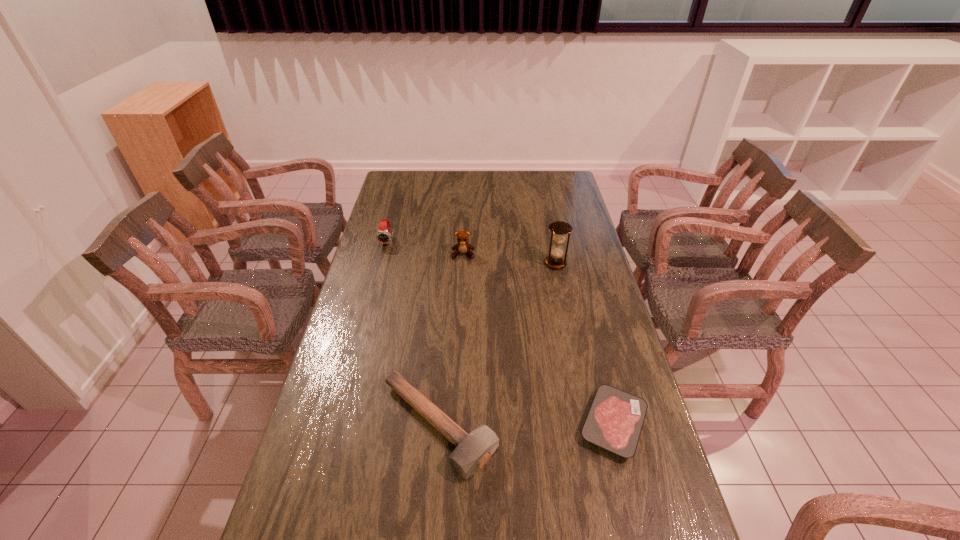
You are a GUI agent. You are given a task and a screenshot of the screen. Output one action in this format:
    pyautogui.click(x=<x>, y=<y>)
    Task: Click on the vacant space that satisfies the following two spatial constraints: 1. on the face of the steak; 2. on the left side of the farthest object
    This screenshot has height=540, width=960.
    Given the screenshot: What is the action you would take?
    coord(339,424)

At what (x,y) coordinates should I click in order to perform the action: click on free spot that satisfies the following two spatial constraints: 1. on the face of the hourglass; 2. on the left side of the farthest object. Please return your answer as a coordinate pair (x, y). Looking at the image, I should click on (381, 264).

Find the location of a particular element. free space that satisfies the following two spatial constraints: 1. on the face of the farthest object; 2. on the left side of the shortest object is located at coordinates (339, 424).

This screenshot has height=540, width=960. What are the coordinates of `vacant position in the image that satisfies the following two spatial constraints: 1. on the face of the steak; 2. on the left side of the watch` in the screenshot? It's located at (339, 424).

You are a GUI agent. You are given a task and a screenshot of the screen. Output one action in this format:
    pyautogui.click(x=<x>, y=<y>)
    Task: Click on the free location that satisfies the following two spatial constraints: 1. on the face of the farthest object; 2. on the right side of the mallet
    The height and width of the screenshot is (540, 960).
    Given the screenshot: What is the action you would take?
    pyautogui.click(x=338, y=426)

This screenshot has height=540, width=960. Find the location of `free space that satisfies the following two spatial constraints: 1. on the face of the tallest object; 2. on the right side of the watch`. free space that satisfies the following two spatial constraints: 1. on the face of the tallest object; 2. on the right side of the watch is located at coordinates (381, 264).

The width and height of the screenshot is (960, 540). What are the coordinates of `free space that satisfies the following two spatial constraints: 1. on the back side of the second shortest object; 2. on the left side of the hourglass` in the screenshot? It's located at (451, 264).

Find the location of a particular element. The height and width of the screenshot is (540, 960). free space that satisfies the following two spatial constraints: 1. on the front-facing side of the tallest object; 2. on the left side of the teddy bear is located at coordinates (463, 264).

You are a GUI agent. You are given a task and a screenshot of the screen. Output one action in this format:
    pyautogui.click(x=<x>, y=<y>)
    Task: Click on the vacant space that satisfies the following two spatial constraints: 1. on the face of the mallet; 2. on the right side of the watch
    Image resolution: width=960 pixels, height=540 pixels.
    Given the screenshot: What is the action you would take?
    pyautogui.click(x=338, y=426)